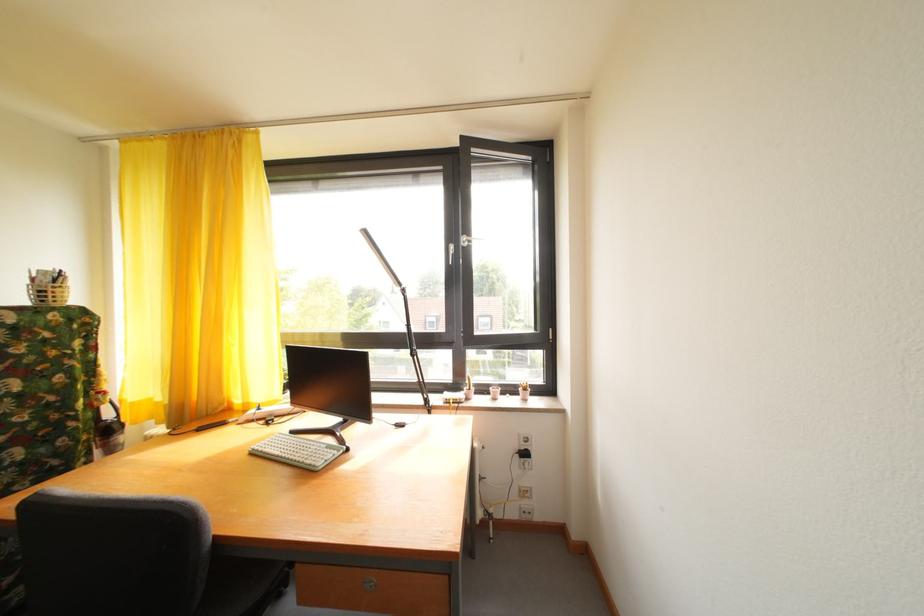
The image size is (924, 616). What do you see at coordinates (450, 253) in the screenshot?
I see `the window handle` at bounding box center [450, 253].